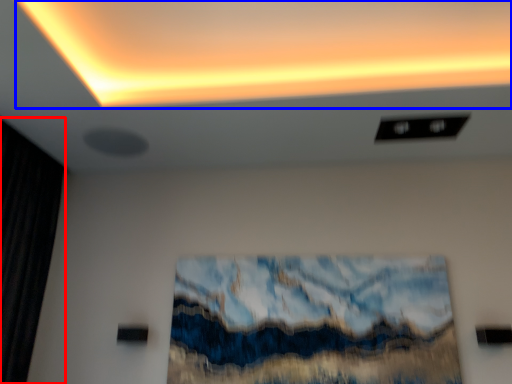
Question: Which point is closer to the camera, curtain (highlighted by a red box) or glow (highlighted by a blue box)?

Choices:
 (A) curtain
 (B) glow

Answer: (B)